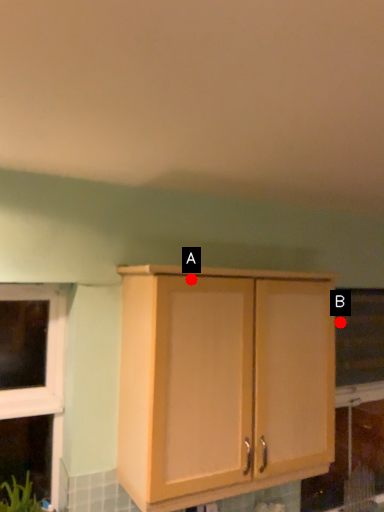
Question: Two points are circled on the image, labeled by A and B beside each circle. Which point is further to the camera?

Choices:
 (A) A is further
 (B) B is further

Answer: (B)